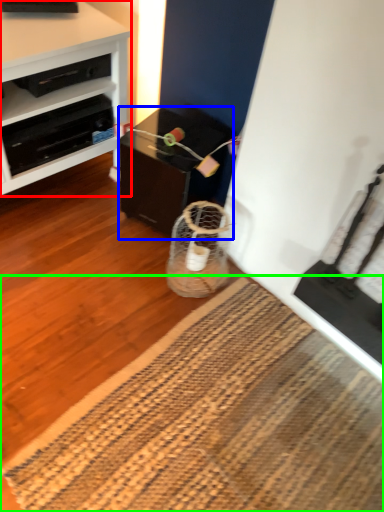
Question: Which is farther away from desk (highlighted by a red box)? table (highlighted by a blue box) or mat (highlighted by a green box)?

Choices:
 (A) table
 (B) mat

Answer: (B)